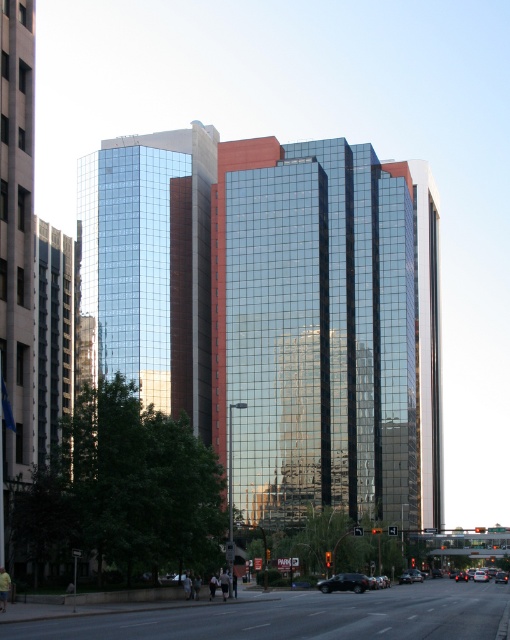
Can you confirm if glossy glass building at center is taller than shiny black sedan at center?

Yes.

Who is shorter, glossy glass building at center or shiny black sedan at center?

Standing shorter between the two is shiny black sedan at center.

What are the coordinates of `glossy glass building at center` in the screenshot? It's located at (273, 314).

The image size is (510, 640). Identify the location of glossy glass building at center. (273, 314).

Find the location of a particular element. shiny black sedan at center is located at coordinates (344, 582).

Is point (325, 589) less distant than point (483, 573)?

Yes, it is in front of point (483, 573).

Locate an element on the screen. This screenshot has width=510, height=640. shiny black sedan at center is located at coordinates (344, 582).

Find the location of a particular element. This screenshot has height=640, width=510. shiny black sedan at center is located at coordinates (344, 582).

Is glossy glass building at center shorter than metallic silver sedan at center?

No.

Between glossy glass building at center and metallic silver sedan at center, which one has less height?

metallic silver sedan at center

Who is more forward, (318, 275) or (482, 580)?

Point (318, 275) is more forward.

Locate an element on the screen. The image size is (510, 640). glossy glass building at center is located at coordinates (273, 314).